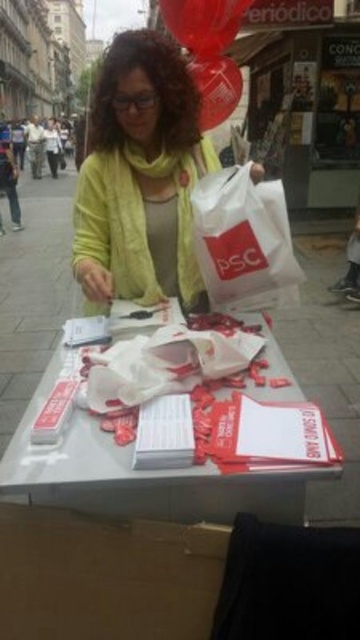
The height and width of the screenshot is (640, 360). What do you see at coordinates (141, 177) in the screenshot?
I see `matte yellow cardigan at center` at bounding box center [141, 177].

I want to click on matte yellow cardigan at center, so click(x=141, y=177).

Does brown cardboard box at lower left have a greater width compared to white paper at center?

In fact, brown cardboard box at lower left might be narrower than white paper at center.

The height and width of the screenshot is (640, 360). What do you see at coordinates (105, 576) in the screenshot?
I see `brown cardboard box at lower left` at bounding box center [105, 576].

Where is `brown cardboard box at lower left`? Image resolution: width=360 pixels, height=640 pixels. brown cardboard box at lower left is located at coordinates (105, 576).

Consider the image. Is white paper at center shorter than rubberized glossy balloon at upper center?

Indeed, white paper at center has a lesser height compared to rubberized glossy balloon at upper center.

Describe the element at coordinates (140, 476) in the screenshot. This screenshot has width=360, height=640. I see `white paper at center` at that location.

This screenshot has width=360, height=640. I want to click on white paper at center, so click(x=140, y=476).